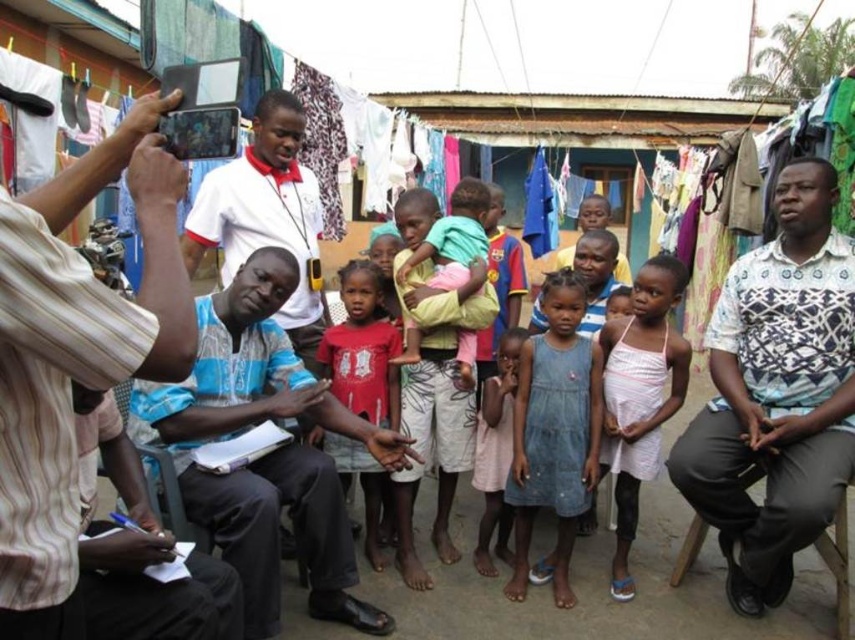
Question: Observing the image, what is the correct spatial positioning of red cotton shirt at center in reference to pink fabric dress at center?

Choices:
 (A) left
 (B) right

Answer: (A)

Question: Is white patterned shirt at right further to camera compared to pink fabric dress at center?

Choices:
 (A) no
 (B) yes

Answer: (A)

Question: Does denim dress at center have a larger size compared to yellow cotton shirt at center?

Choices:
 (A) no
 (B) yes

Answer: (B)

Question: Which of the following is the closest to the observer?

Choices:
 (A) (575, 324)
 (B) (696, 493)
 (C) (0, 188)
 (D) (510, 552)

Answer: (C)

Question: Which object appears closest to the camera in this image?

Choices:
 (A) striped cotton shirt at left
 (B) white patterned shirt at right
 (C) blue cotton shirt at center
 (D) red cotton shirt at center

Answer: (A)

Question: Which point is closer to the camera?

Choices:
 (A) yellow cotton shirt at center
 (B) white cotton dress at center
 (C) striped cotton shirt at left

Answer: (C)